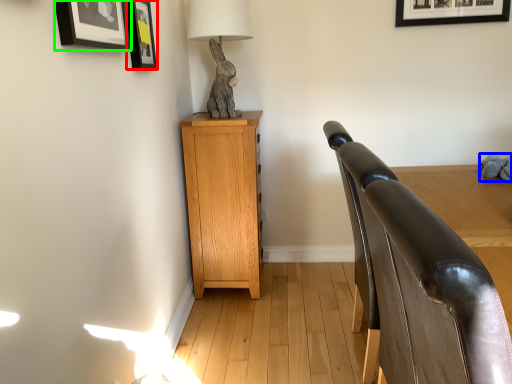
Question: Which object is the closest to the picture frame (highlighted by a red box)? Choose among these: animal (highlighted by a blue box) or picture frame (highlighted by a green box).

Choices:
 (A) animal
 (B) picture frame

Answer: (B)